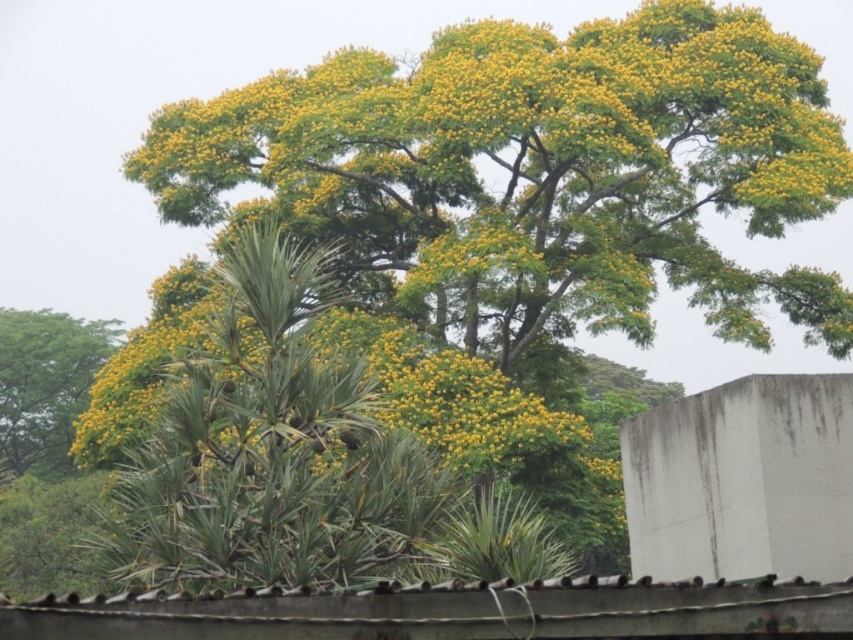
Question: Considering the relative positions of yellow-green foliage at center and yellow-green foliage at left in the image provided, where is yellow-green foliage at center located with respect to yellow-green foliage at left?

Choices:
 (A) above
 (B) below

Answer: (A)

Question: Which point is farther from the camera taking this photo?

Choices:
 (A) (93, 339)
 (B) (529, 301)

Answer: (A)

Question: Which object appears farthest from the camera in this image?

Choices:
 (A) yellow-green foliage at center
 (B) yellow-green foliage at left

Answer: (B)

Question: Is yellow-green foliage at center above yellow-green foliage at left?

Choices:
 (A) yes
 (B) no

Answer: (A)

Question: Is yellow-green foliage at center behind yellow-green foliage at left?

Choices:
 (A) yes
 (B) no

Answer: (B)

Question: Which object is farther from the camera taking this photo?

Choices:
 (A) yellow-green foliage at left
 (B) yellow-green foliage at center

Answer: (A)